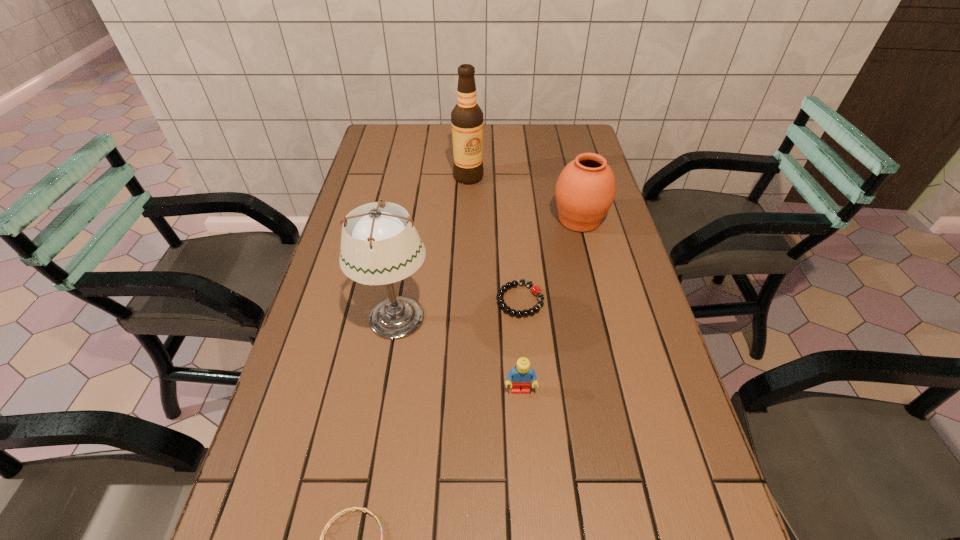
I want to click on free location located 0.260m on the lampshade of the lampshade, so click(x=541, y=319).

Where is `vacant space located on the front of the third tallest object`? The width and height of the screenshot is (960, 540). vacant space located on the front of the third tallest object is located at coordinates (599, 299).

This screenshot has width=960, height=540. In order to click on free space located 0.130m on the face of the third shortest object in this screenshot , I will do `click(525, 460)`.

Where is `free spot located on the left of the second shortest object`? This screenshot has width=960, height=540. free spot located on the left of the second shortest object is located at coordinates (392, 300).

Where is `object situated at the left edge`? object situated at the left edge is located at coordinates click(x=380, y=245).

At what (x,y) coordinates should I click in order to perform the action: click on object present at the right edge. Please return your answer as a coordinate pair (x, y). The height and width of the screenshot is (540, 960). Looking at the image, I should click on (585, 190).

This screenshot has height=540, width=960. In order to click on free space at the far edge of the desktop in this screenshot , I will do `click(437, 125)`.

Locate an element on the screen. The height and width of the screenshot is (540, 960). vacant space at the left edge is located at coordinates (300, 367).

In the image, there is a desktop. Identify the location of vacant area at the right edge. This screenshot has height=540, width=960. (694, 474).

Locate an element on the screen. vacant space at the far left corner of the desktop is located at coordinates coord(371,135).